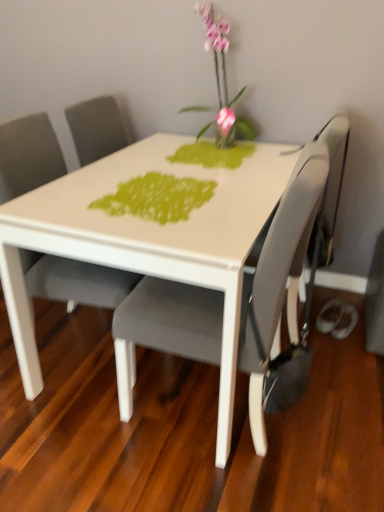
The image size is (384, 512). Find the location of `vacant space behind green textured placemat at center`. vacant space behind green textured placemat at center is located at coordinates (155, 165).